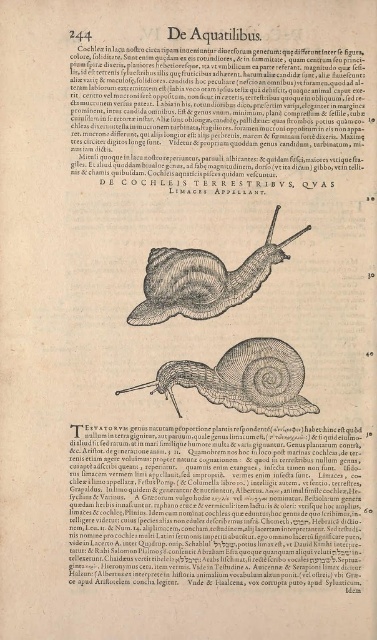
Question: Does matte yellow paper at upper center have a lesser width compared to brown textured shell at center?

Choices:
 (A) no
 (B) yes

Answer: (A)

Question: Can you confirm if matte yellow paper at upper center is positioned above matte black snail at center?

Choices:
 (A) yes
 (B) no

Answer: (B)

Question: Which object appears farthest from the camera in this image?

Choices:
 (A) matte black snail at center
 (B) brown textured shell at center
 (C) brown wood snail at center

Answer: (C)

Question: Which point is farther to the camera?

Choices:
 (A) (165, 296)
 (B) (113, 454)

Answer: (A)

Question: Based on their relative distances, which object is farther from the brown wood snail at center?

Choices:
 (A) matte yellow paper at upper center
 (B) matte black snail at center
 (C) brown textured shell at center

Answer: (A)

Question: Can you confirm if brown textured shell at center is smaller than brown wood snail at center?

Choices:
 (A) no
 (B) yes

Answer: (B)